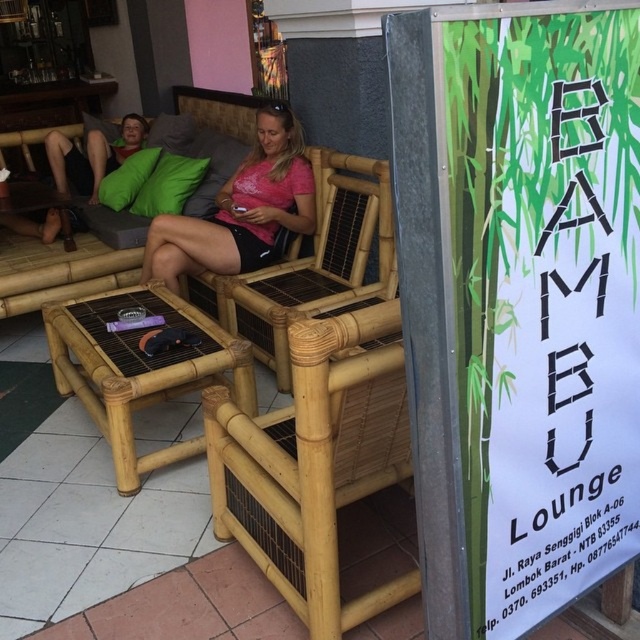
In the scene shown: You are a customer at BAMBU Lounge and want to place your matte pink shirt at center on the natural bamboo chair at center. Will the shirt fit on the chair?

The natural bamboo chair at center is thinner than the matte pink shirt at center, so the shirt may not fit properly on the chair due to the chair being narrower than the shirt.

You are standing at the entrance of the BAMBU Lounge and want to sit on the natural bamboo chair at center. According to the coordinates provided, can you determine if the chair is positioned closer to the entrance or the back of the lounge?

The natural bamboo chair at center is located at point (316, 461), which suggests it is positioned closer to the back of the lounge since the coordinates are closer to the upper right quadrant of the image frame.

You are sitting on the bamboo stool at center and want to reach the table next to the natural bamboo chair at center. Which direction should you move to get to the table?

The natural bamboo chair at center is positioned on the right side of the bamboo stool at center, so you should move to your right to reach the table next to the natural bamboo chair at center.